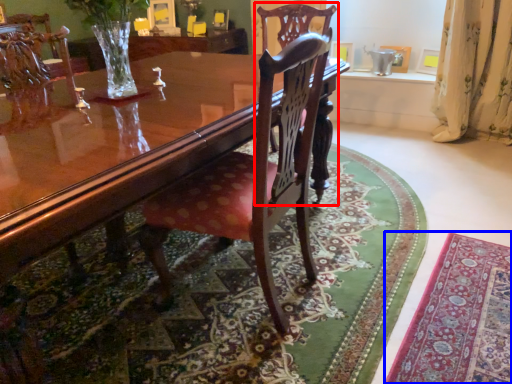
Question: Which object appears closest to the camera in this image, chair (highlighted by a red box) or mat (highlighted by a blue box)?

Choices:
 (A) chair
 (B) mat

Answer: (B)